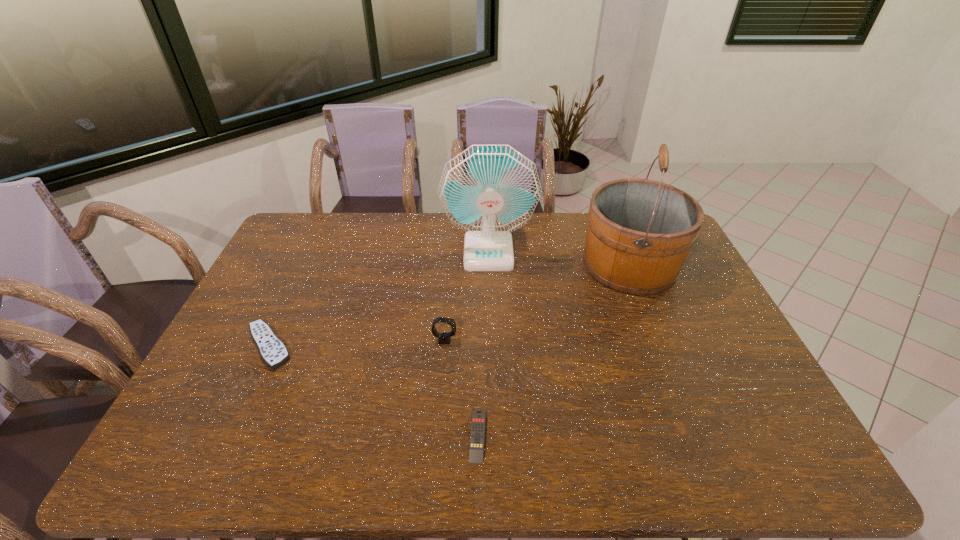
This screenshot has width=960, height=540. What are the coordinates of `blank space at the left edge of the desktop` in the screenshot? It's located at (289, 256).

In the image, there is a desktop. Identify the location of vacant space at the far left corner. The height and width of the screenshot is (540, 960). (302, 221).

Image resolution: width=960 pixels, height=540 pixels. I want to click on empty space that is in between the fan and the taller remote control, so click(x=378, y=299).

At what (x,y) coordinates should I click in order to perform the action: click on vacant space in between the third tallest object and the leftmost object. Please return your answer as a coordinate pair (x, y). This screenshot has height=540, width=960. Looking at the image, I should click on (356, 343).

The width and height of the screenshot is (960, 540). In order to click on free space between the bucket and the third shortest object in this screenshot , I will do `click(538, 302)`.

Find the location of a particular element. Image resolution: width=960 pixels, height=540 pixels. vacant area that lies between the watch and the leftmost object is located at coordinates (356, 343).

Locate an element on the screen. vacant area between the rightmost object and the fourth tallest object is located at coordinates (449, 305).

Image resolution: width=960 pixels, height=540 pixels. I want to click on free spot between the third tallest object and the shortest object, so click(x=462, y=387).

This screenshot has width=960, height=540. I want to click on free space that is in between the leftmost object and the nearer remote control, so click(373, 390).

Locate an element on the screen. empty space that is in between the bucket and the watch is located at coordinates (538, 302).